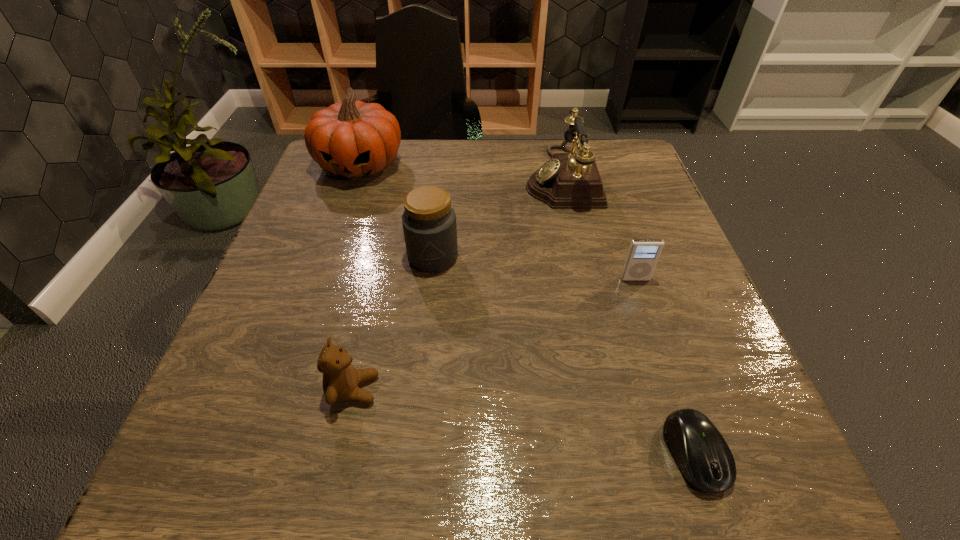
Where is `pumpkin`? The width and height of the screenshot is (960, 540). pumpkin is located at coordinates (353, 139).

Find the location of a particular element. Image resolution: width=960 pixels, height=540 pixels. telephone is located at coordinates (570, 180).

Find the location of `the fourth nearest object`. the fourth nearest object is located at coordinates (429, 222).

The height and width of the screenshot is (540, 960). Find the location of `jar`. jar is located at coordinates (429, 222).

Where is `teddy bear`? teddy bear is located at coordinates (340, 381).

Find the location of a particular element. This screenshot has height=540, width=960. the fourth farthest object is located at coordinates pyautogui.click(x=643, y=254).

Locate an element on the screen. Image resolution: width=960 pixels, height=540 pixels. mouse is located at coordinates (704, 458).

Where is `free space located 0.360m on the face of the pumpkin`? free space located 0.360m on the face of the pumpkin is located at coordinates (310, 309).

What are the coordinates of `vacant space situated 0.190m on the dial of the telephone` in the screenshot? It's located at coord(446,177).

Where is `blank space located 0.110m on the dial of the telephone`? blank space located 0.110m on the dial of the telephone is located at coordinates (479, 177).